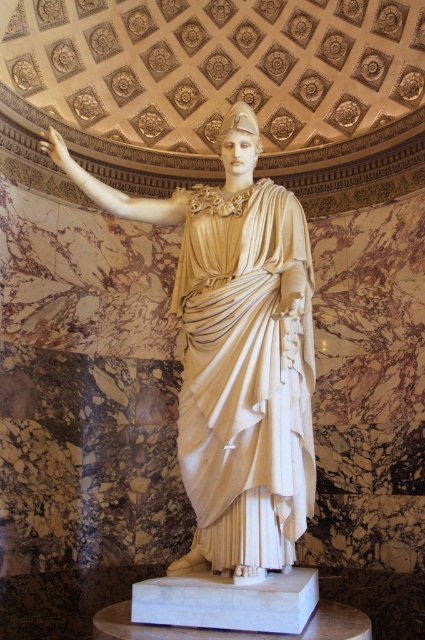
Which is behind, point (238, 442) or point (286, 198)?

The point (286, 198) is behind.

Who is lower down, white marble statue at center or white marble robe at center?

white marble robe at center is lower down.

Identify the location of white marble statue at center. (237, 353).